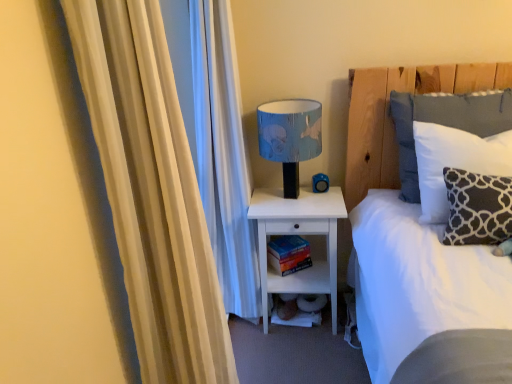
What is the approximate width of white soft bed at upper right?

The width of white soft bed at upper right is 1.88 meters.

Describe the element at coordinates (444, 124) in the screenshot. I see `white cotton pillow at upper right, marked as the first pillow in a back-to-front arrangement` at that location.

You are a GUI agent. You are given a task and a screenshot of the screen. Output one action in this format:
    pyautogui.click(x=<x>, y=<y>)
    Task: Click on the blue fabric lampshade at upper center
    
    Given the screenshot: What is the action you would take?
    pyautogui.click(x=290, y=136)

Where is `dark gray fabric pillow at right, which is the 2th pillow from back to front`? dark gray fabric pillow at right, which is the 2th pillow from back to front is located at coordinates (477, 208).

Considering the positions of objects blue fabric lampshade at upper center and hardcover book at lower center in the image provided, who is in front, blue fabric lampshade at upper center or hardcover book at lower center?

blue fabric lampshade at upper center.

Is blue fabric lampshade at upper center at the left side of hardcover book at lower center?

Yes.

Can you tell me how much blue fabric lampshade at upper center and hardcover book at lower center differ in facing direction?

The angle between the facing direction of blue fabric lampshade at upper center and the facing direction of hardcover book at lower center is 33.1 degrees.

Is blue fabric lampshade at upper center inside or outside of hardcover book at lower center?

blue fabric lampshade at upper center is not inside hardcover book at lower center, it's outside.

Is beige fabric curtain at left positioned with its back to dark gray fabric pillow at right, the 1th pillow viewed from the front?

That's not correct — beige fabric curtain at left is not looking away from dark gray fabric pillow at right, the 1th pillow viewed from the front.

In terms of height, does beige fabric curtain at left look taller or shorter compared to dark gray fabric pillow at right, the 1th pillow viewed from the front?

Clearly, beige fabric curtain at left is taller compared to dark gray fabric pillow at right, the 1th pillow viewed from the front.

Considering the relative positions of beige fabric curtain at left and dark gray fabric pillow at right, which is the 2th pillow from back to front, in the image provided, is beige fabric curtain at left in front of dark gray fabric pillow at right, which is the 2th pillow from back to front,?

That is True.

Where is `curtain in front of the dark gray fabric pillow at right, which is the 2th pillow from back to front`? curtain in front of the dark gray fabric pillow at right, which is the 2th pillow from back to front is located at coordinates click(151, 191).

Is hardcover book at lower center turned away from white soft bed at upper right?

No, white soft bed at upper right is not at the back of hardcover book at lower center.

Considering the relative sizes of hardcover book at lower center and white soft bed at upper right in the image provided, is hardcover book at lower center wider than white soft bed at upper right?

No.

In the image, is hardcover book at lower center positioned in front of or behind white soft bed at upper right?

In the image, hardcover book at lower center appears behind white soft bed at upper right.

Who is bigger, dark gray fabric pillow at right, the 1th pillow viewed from the front, or white matte nightstand at lower center?

With larger size is white matte nightstand at lower center.

Can you confirm if dark gray fabric pillow at right, which is the 2th pillow from back to front, is wider than white matte nightstand at lower center?

No.

Is dark gray fabric pillow at right, the 1th pillow viewed from the front, to the left or to the right of white matte nightstand at lower center in the image?

In the image, dark gray fabric pillow at right, the 1th pillow viewed from the front, appears on the right side of white matte nightstand at lower center.

Is dark gray fabric pillow at right, which is the 2th pillow from back to front, facing away from white matte nightstand at lower center?

dark gray fabric pillow at right, which is the 2th pillow from back to front, does not have its back to white matte nightstand at lower center.

From the image's perspective, would you say hardcover book at lower center is shown under dark gray fabric pillow at right, the 1th pillow viewed from the front?

Yes, from the image's perspective, hardcover book at lower center is beneath dark gray fabric pillow at right, the 1th pillow viewed from the front.

From the picture: From a real-world perspective, between hardcover book at lower center and dark gray fabric pillow at right, the 1th pillow viewed from the front, who is vertically lower?

From a 3D spatial view, hardcover book at lower center is below.

There is a hardcover book at lower center. Identify the location of the 1st pillow above it (from the image's perspective). (477, 208).

How much distance is there between hardcover book at lower center and dark gray fabric pillow at right, which is the 2th pillow from back to front?

A distance of 36.85 inches exists between hardcover book at lower center and dark gray fabric pillow at right, which is the 2th pillow from back to front.

From the image's perspective, which one is positioned higher, dark gray fabric pillow at right, which is the 2th pillow from back to front, or beige fabric curtain at left?

dark gray fabric pillow at right, which is the 2th pillow from back to front.

From a real-world perspective, is dark gray fabric pillow at right, which is the 2th pillow from back to front, on beige fabric curtain at left?

Actually, dark gray fabric pillow at right, which is the 2th pillow from back to front, is physically below beige fabric curtain at left in the real world.

Is dark gray fabric pillow at right, which is the 2th pillow from back to front, with beige fabric curtain at left?

No.

Which object is thinner, white cotton pillow at upper right, which is the second pillow from front to back, or beige fabric curtain at left?

beige fabric curtain at left is thinner.

From a real-world perspective, is white cotton pillow at upper right, which is the second pillow from front to back, positioned under beige fabric curtain at left based on gravity?

Indeed, from a real-world perspective, white cotton pillow at upper right, which is the second pillow from front to back, is positioned beneath beige fabric curtain at left.

The image size is (512, 384). I want to click on book that appears on the right of blue fabric lampshade at upper center, so click(288, 254).

Locate an element on the screen. curtain in front of the dark gray fabric pillow at right, the 1th pillow viewed from the front is located at coordinates (151, 191).

Considering their positions, is dark gray fabric pillow at right, the 1th pillow viewed from the front, positioned further to white matte nightstand at lower center than hardcover book at lower center?

Among the two, dark gray fabric pillow at right, the 1th pillow viewed from the front, is located further to white matte nightstand at lower center.

Estimate the real-world distances between objects in this image. Which object is closer to blue fabric lampshade at upper center, beige fabric curtain at left or hardcover book at lower center?

hardcover book at lower center is closer to blue fabric lampshade at upper center.

Considering their positions, is beige fabric curtain at left positioned closer to blue fabric lampshade at upper center than white cotton pillow at upper right, marked as the first pillow in a back-to-front arrangement?

white cotton pillow at upper right, marked as the first pillow in a back-to-front arrangement, lies closer to blue fabric lampshade at upper center than the other object.

From the image, which object appears to be nearer to blue fabric lampshade at upper center, white matte nightstand at lower center or beige fabric curtain at left?

white matte nightstand at lower center is positioned closer to the anchor blue fabric lampshade at upper center.

When comparing their distances from white matte nightstand at lower center, does hardcover book at lower center or white soft bed at upper right seem further?

Based on the image, white soft bed at upper right appears to be further to white matte nightstand at lower center.

From the image, which object appears to be nearer to dark gray fabric pillow at right, which is the 2th pillow from back to front, beige fabric curtain at left or white soft bed at upper right?

white soft bed at upper right is positioned closer to the anchor dark gray fabric pillow at right, which is the 2th pillow from back to front.

Estimate the real-world distances between objects in this image. Which object is further from beige fabric curtain at left, hardcover book at lower center or blue fabric lampshade at upper center?

hardcover book at lower center is positioned further to the anchor beige fabric curtain at left.

Looking at the image, which one is located closer to hardcover book at lower center, blue fabric lampshade at upper center or white cotton pillow at upper right, which is the second pillow from front to back?

Based on the image, blue fabric lampshade at upper center appears to be nearer to hardcover book at lower center.

I want to click on nightstand located between dark gray fabric pillow at right, the 1th pillow viewed from the front, and hardcover book at lower center in the depth direction, so click(298, 234).

The height and width of the screenshot is (384, 512). I want to click on book between blue fabric lampshade at upper center and white matte nightstand at lower center vertically, so click(288, 254).

At what (x,y) coordinates should I click in order to perform the action: click on table lamp between white soft bed at upper right and hardcover book at lower center in the front-back direction. Please return your answer as a coordinate pair (x, y). This screenshot has height=384, width=512. Looking at the image, I should click on (290, 136).

Where is `book between blue fabric lampshade at upper center and white cotton pillow at upper right, which is the second pillow from front to back`? The width and height of the screenshot is (512, 384). book between blue fabric lampshade at upper center and white cotton pillow at upper right, which is the second pillow from front to back is located at coordinates (288, 254).